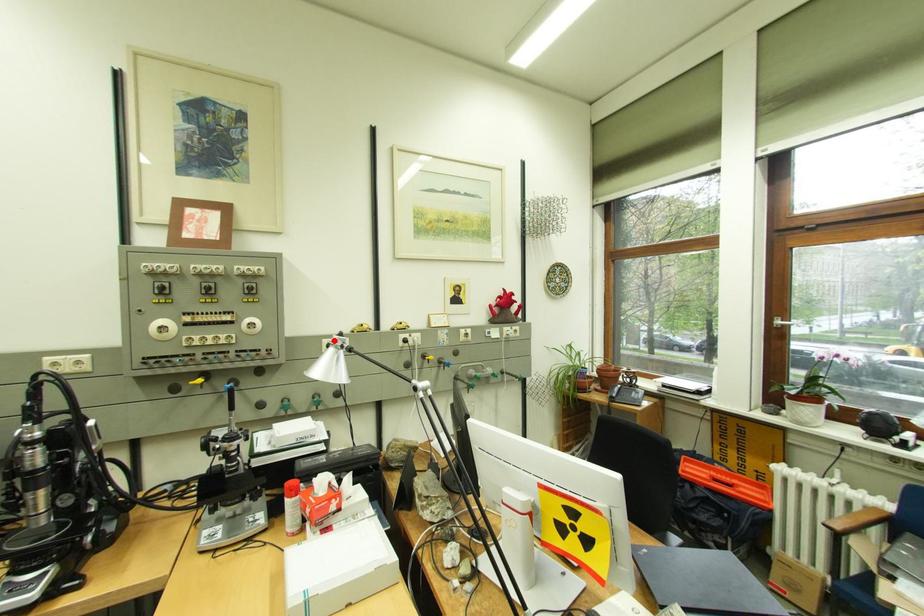
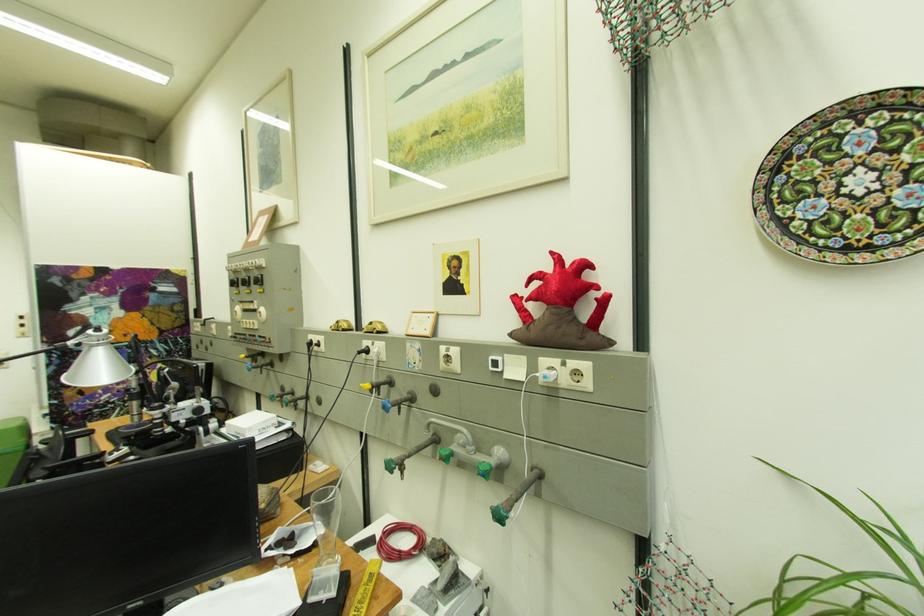
The point at the highlighted location is marked in the first image. Where is the corresponding point in the second image?

(320, 336)